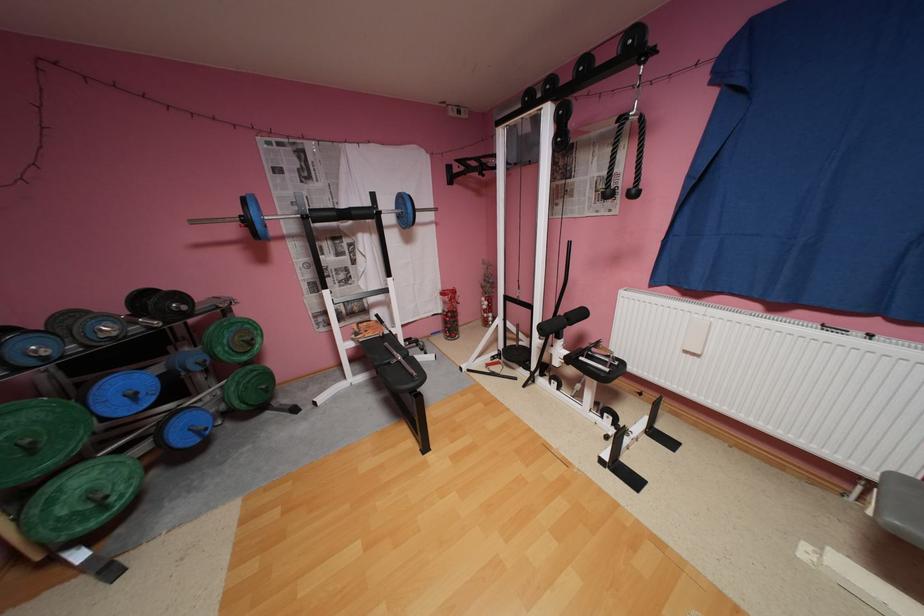
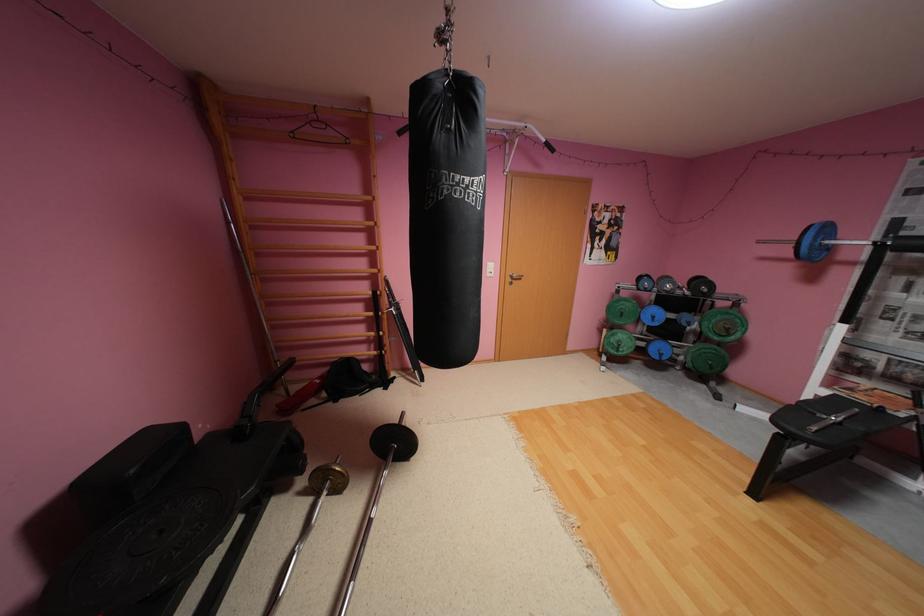
Locate, in the second image, the point that corresponds to pixel 116 508 in the first image.

(626, 351)